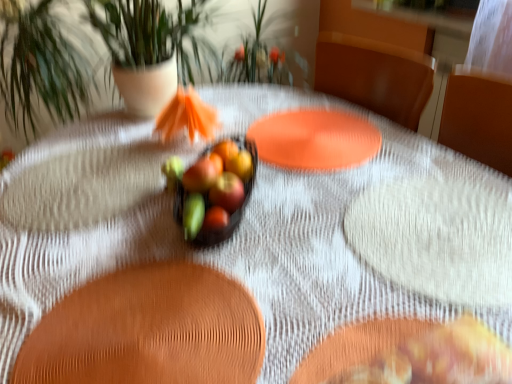
Find the location of a particular element. The height and width of the screenshot is (384, 512). vacant space situated on the left part of glossy red apple at center, which is the second fruit from left to right is located at coordinates (122, 247).